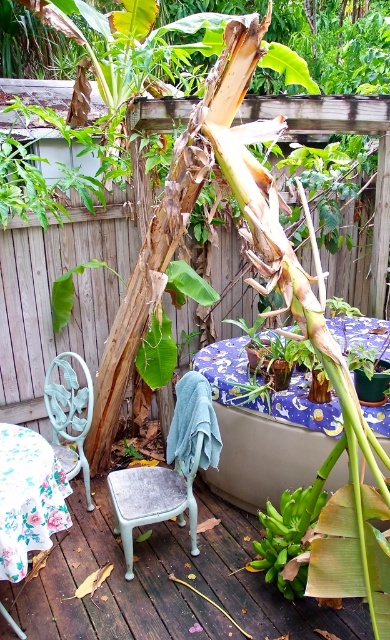
You are a painter who needs to paint the wooden fence at upper center and the light blue painted metal chair at lower left. You have a 12 inch wide paint roller. Can you paint both objects without moving the roller? Explain why or why not.

The wooden fence at upper center is 20.18 inches from the light blue painted metal chair at lower left. Since the distance between them is greater than the 12 inch width of the paint roller, you will need to move the roller to reach both objects.

You are standing on the wooden deck at center and want to sit down on the light blue painted metal chair at lower left. Considering the height difference between the two, will you need to step down from the deck to reach the chair?

The wooden deck at center has a lesser height compared to the light blue painted metal chair at lower left, so you will need to step down from the deck to reach the chair.